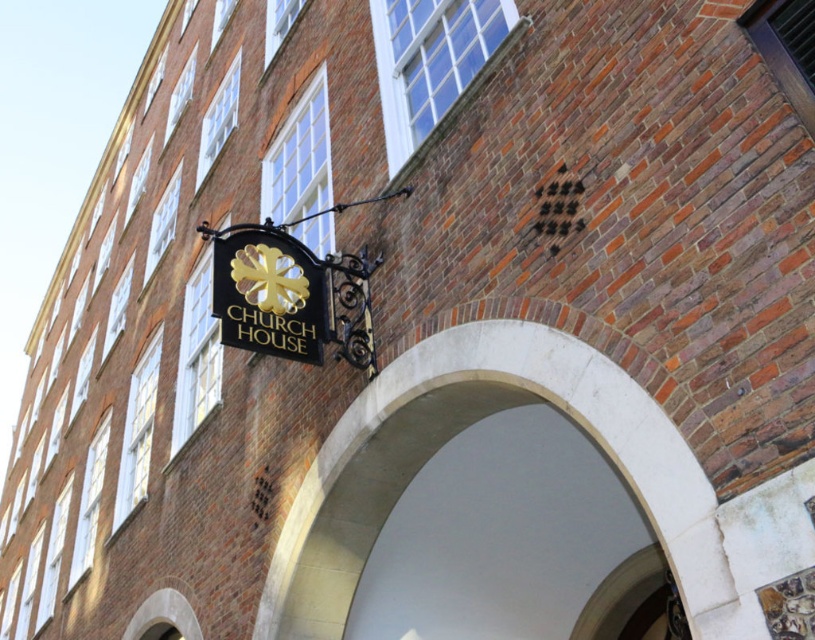
You are standing in front of the brick building and want to touch both the white stone arch at center and the gold metallic sign at center. Which object should you reach for first to touch the closer one?

The white stone arch at center is closer to the viewer than the gold metallic sign at center, so you should reach for the white stone arch at center first.

You are an architect analyzing the facade of a historic building. You notice the white stone arch at center and the gold metallic sign at center. Which object would cast a longer shadow during midday when the sun is directly overhead?

The white stone arch at center is larger in size than the gold metallic sign at center, so it would cast a longer shadow during midday when the sun is directly overhead.